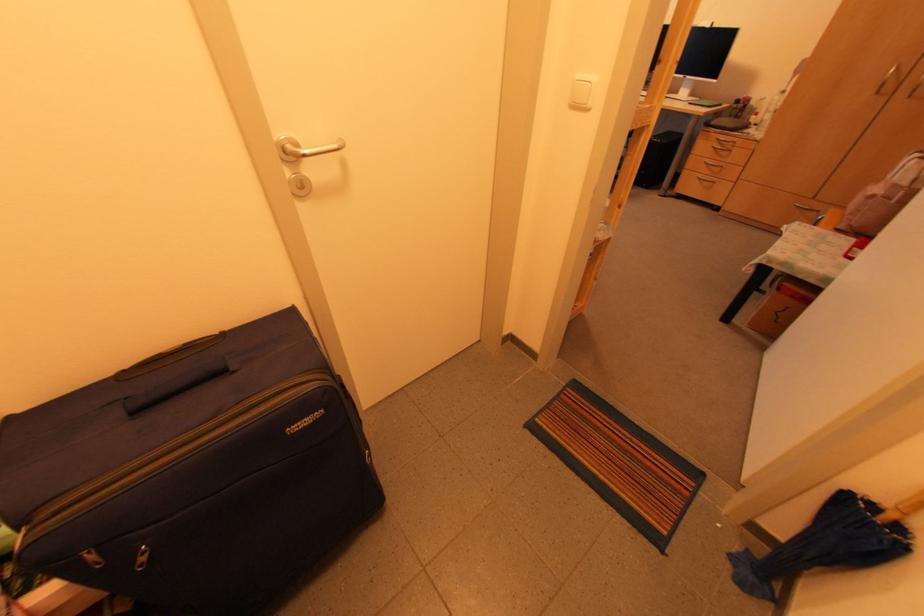
The height and width of the screenshot is (616, 924). In order to click on white light switch in this screenshot , I will do click(x=581, y=92).